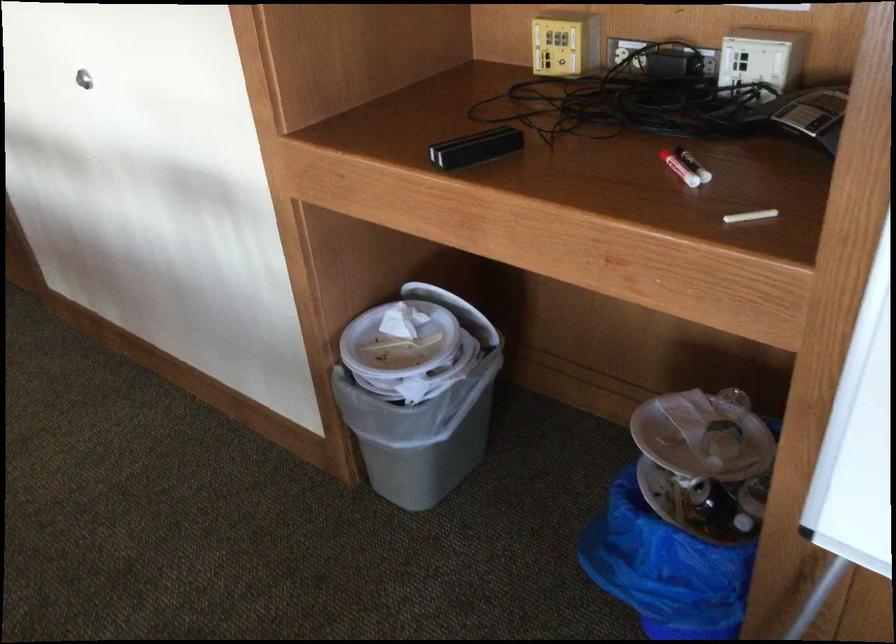
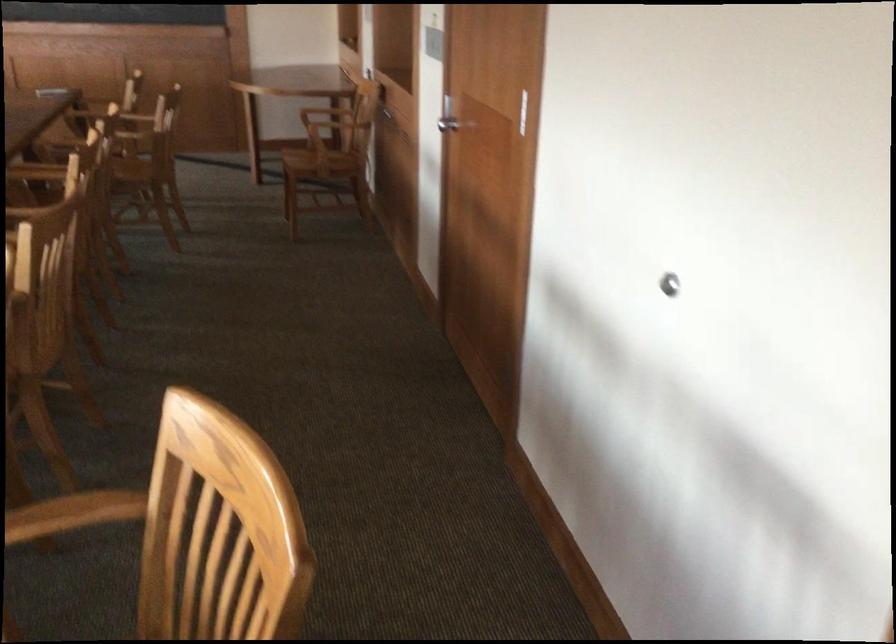
The point at (80, 79) is marked in the first image. Where is the corresponding point in the second image?

(669, 283)